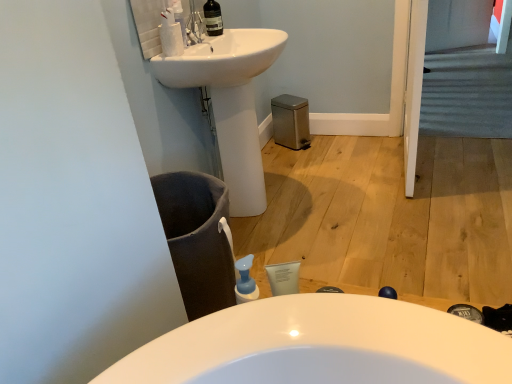
At what (x,y) coordinates should I click in order to perform the action: click on free space below white glossy sink at upper center (from a real-world perspective). Please return your answer as a coordinate pair (x, y). This screenshot has height=384, width=512. Looking at the image, I should click on [x=264, y=211].